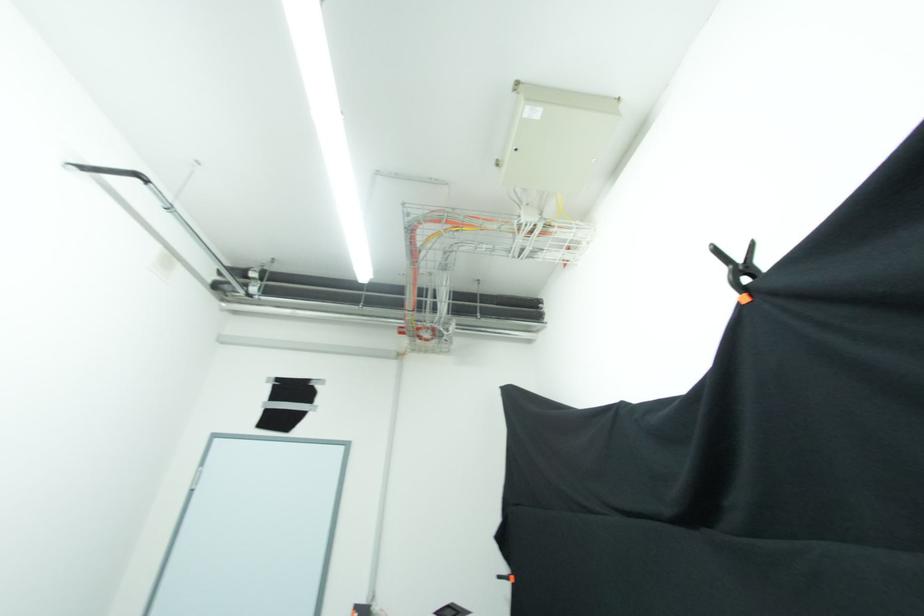
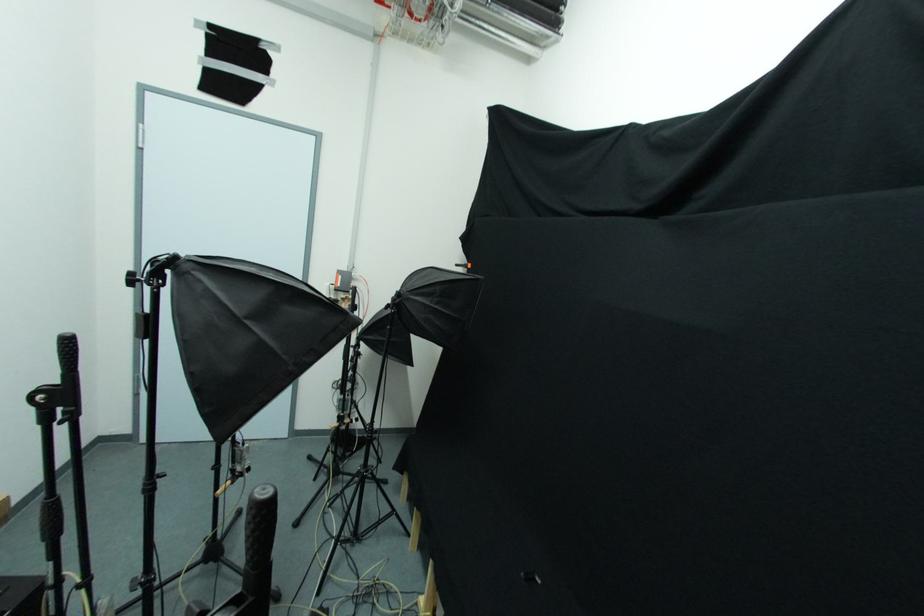
The first image is from the beginning of the video and the second image is from the end. How did the camera likely rotate when shooting the video?

The rotation direction of the camera is right-down.